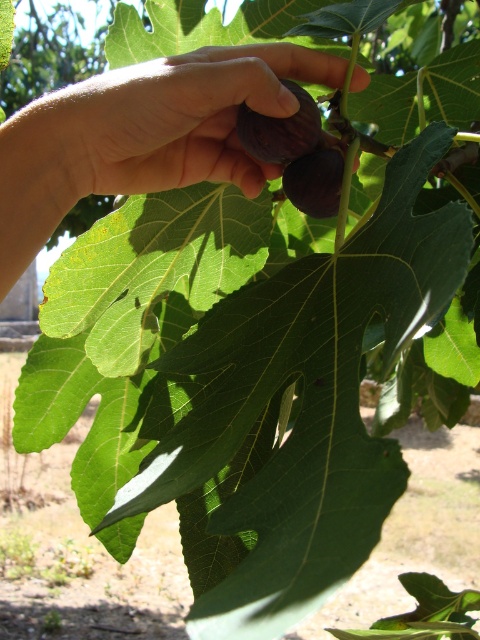
Does matte purple figs at center have a greater width compared to green matte fig at center?

Correct, the width of matte purple figs at center exceeds that of green matte fig at center.

Does point (82, 113) come farther from viewer compared to point (336, 211)?

No, (82, 113) is in front of (336, 211).

Locate an element on the screen. matte purple figs at center is located at coordinates (142, 134).

Which of these two, matte purple figs at center or purple matte fig at center, stands taller?

With more height is matte purple figs at center.

Between matte purple figs at center and purple matte fig at center, which one is positioned lower?

matte purple figs at center is lower down.

Which is behind, point (101, 150) or point (312, 141)?

Point (312, 141)

The width and height of the screenshot is (480, 640). What are the coordinates of `matte purple figs at center` in the screenshot? It's located at (142, 134).

Does purple matte fig at center have a lesser width compared to green matte fig at center?

No.

Which of these two, purple matte fig at center or green matte fig at center, stands shorter?

purple matte fig at center

This screenshot has height=640, width=480. Find the location of `purple matte fig at center`. purple matte fig at center is located at coordinates (280, 131).